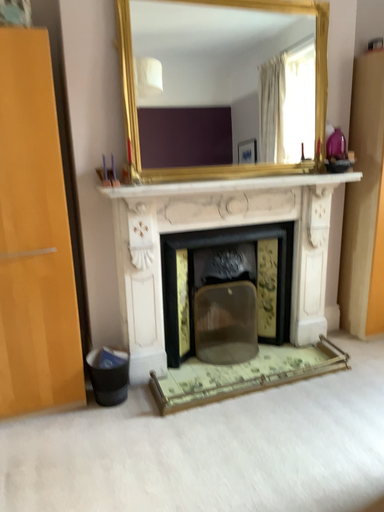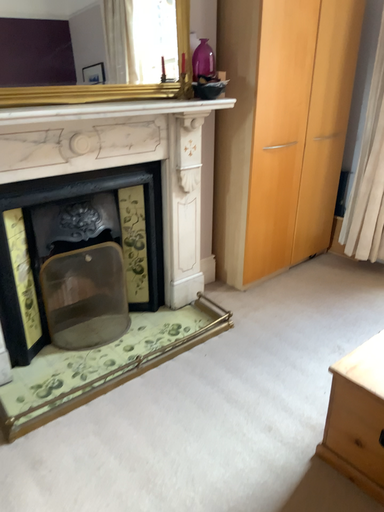
Question: How did the camera likely rotate when shooting the video?

Choices:
 (A) rotated upward
 (B) rotated downward

Answer: (B)